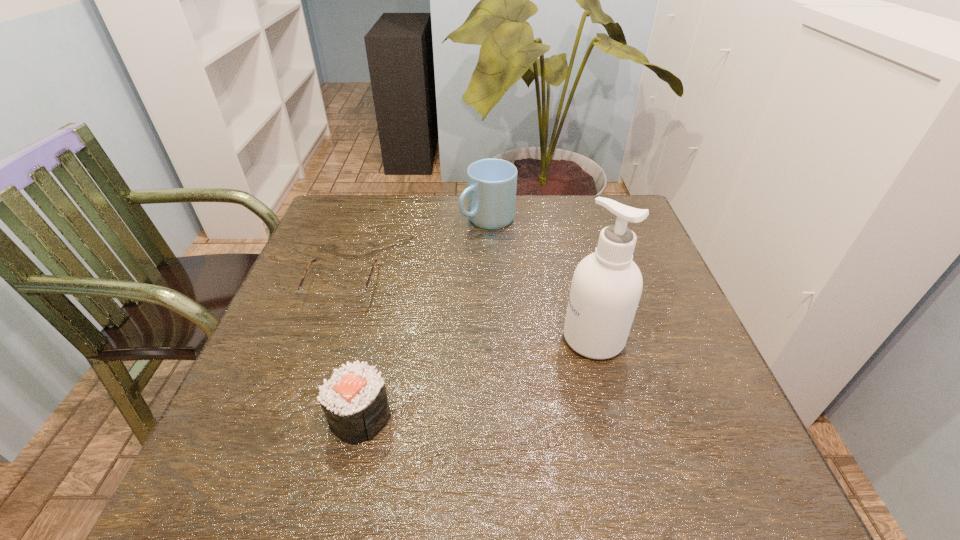
This screenshot has width=960, height=540. Identify the location of blank space at the right edge of the desktop. (725, 405).

This screenshot has height=540, width=960. Identify the location of vacant region at the far left corner of the desktop. (354, 197).

At what (x,y) coordinates should I click in order to perform the action: click on vacant area at the near right corner of the desktop. Please return your answer as a coordinate pair (x, y). The image size is (960, 540). Looking at the image, I should click on (669, 474).

You are a GUI agent. You are given a task and a screenshot of the screen. Output one action in this format:
    pyautogui.click(x=<x>, y=<y>)
    Task: Click on the empty location between the second farthest object and the third farthest object
    This screenshot has width=960, height=540.
    Given the screenshot: What is the action you would take?
    coord(468,312)

This screenshot has width=960, height=540. Identify the location of empty space that is in between the rightmost object and the second tallest object. (540, 279).

In order to click on free area in between the tallest object and the shortest object in this screenshot , I will do `click(468, 312)`.

Identify the location of blank region between the mug and the sushi. Image resolution: width=960 pixels, height=540 pixels. (424, 318).

Find the location of `unoccupied area between the second object from right to left and the third nearest object`. unoccupied area between the second object from right to left and the third nearest object is located at coordinates (415, 253).

Identify the location of free spot between the nearest object and the shortest object. (351, 352).

Locate an element on the screen. Image resolution: width=960 pixels, height=540 pixels. vacant space in between the sushi and the spectacles is located at coordinates (351, 352).